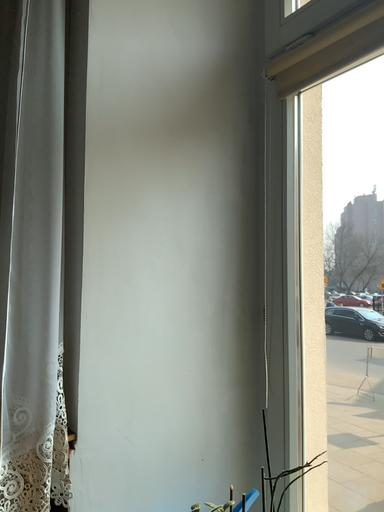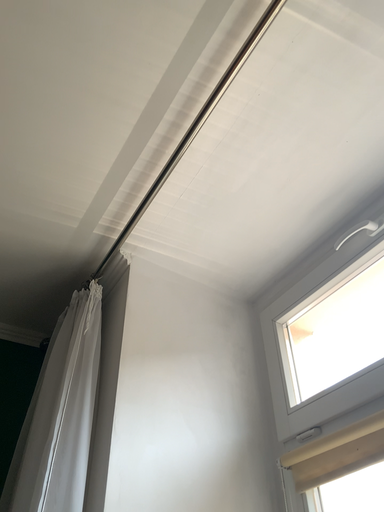
Question: Which way did the camera rotate in the video?

Choices:
 (A) rotated upward
 (B) rotated downward

Answer: (A)